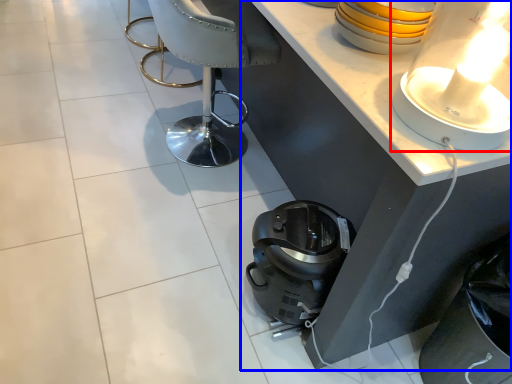
Question: Which point is closer to the camera, lamp (highlighted by a red box) or table (highlighted by a blue box)?

Choices:
 (A) lamp
 (B) table

Answer: (A)